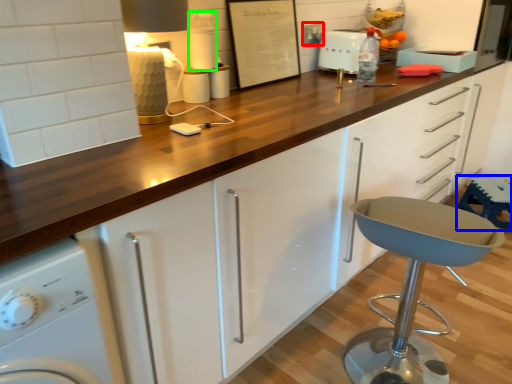
Question: Which object is positioned closest to electric outlet (highlighted by a red box)? Select from bar stool (highlighted by a blue box) and appliance (highlighted by a green box).

Choices:
 (A) bar stool
 (B) appliance

Answer: (B)